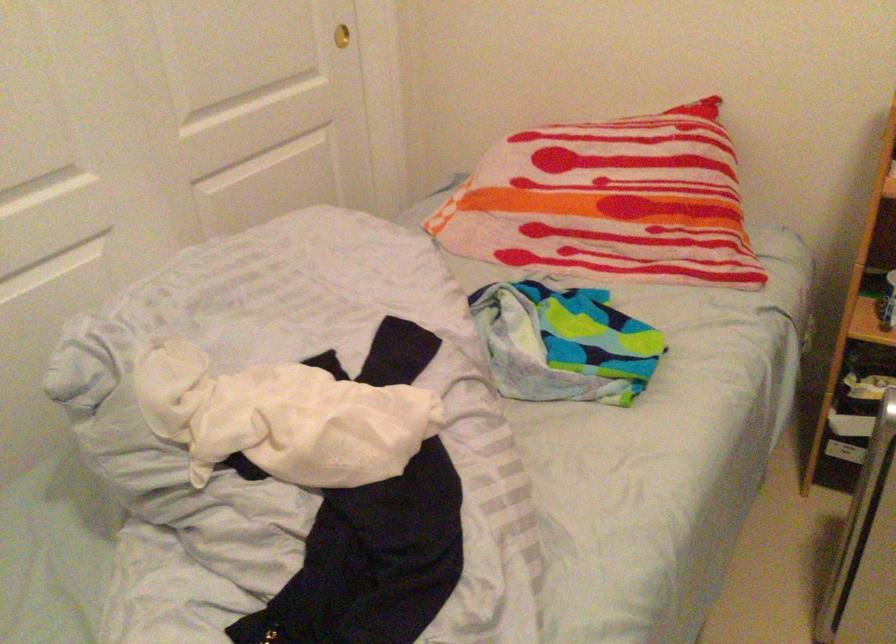
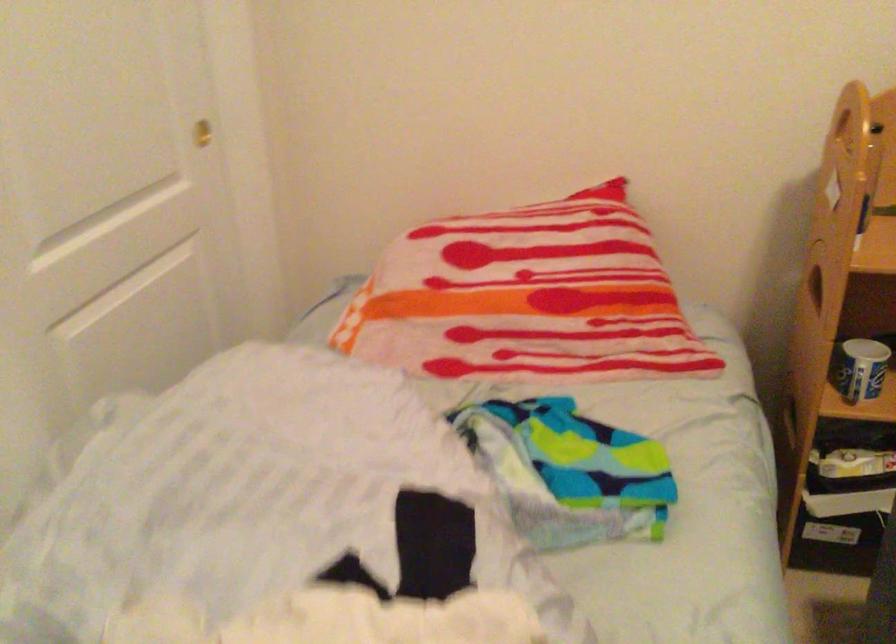
Question: How did the camera likely rotate?

Choices:
 (A) Left
 (B) Right
 (C) Up
 (D) Down

Answer: (B)